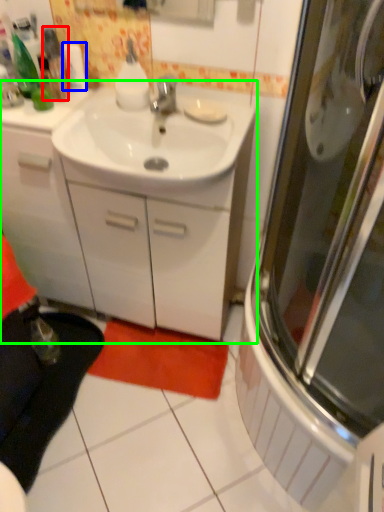
Question: Which object is the farthest from bottle (highlighted by a red box)? Choose among these: toilet paper (highlighted by a blue box) or bathroom cabinet (highlighted by a green box).

Choices:
 (A) toilet paper
 (B) bathroom cabinet

Answer: (B)